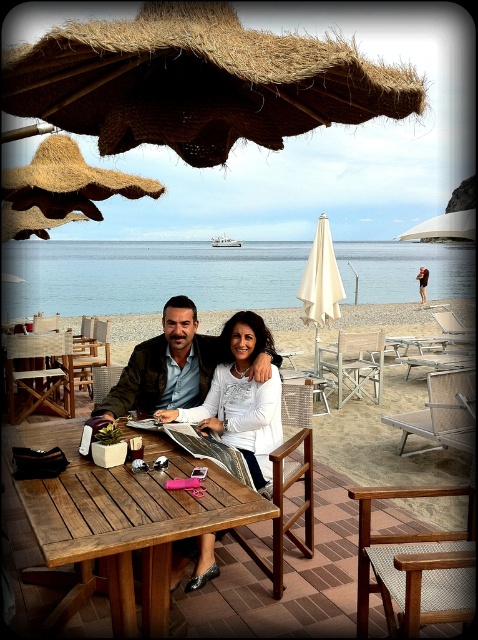
Question: Is thatched straw umbrella at upper center thinner than white matte dress at center?

Choices:
 (A) yes
 (B) no

Answer: (B)

Question: From the image, what is the correct spatial relationship of white matte dress at center in relation to wooden picnic table at center?

Choices:
 (A) below
 (B) above

Answer: (B)

Question: Which point appears farthest from the camera in this image?

Choices:
 (A) (136, 145)
 (B) (251, 381)
 (C) (315, 316)

Answer: (C)

Question: Considering the relative positions of blue water at center and beige fabric umbrella at center in the image provided, where is blue water at center located with respect to beige fabric umbrella at center?

Choices:
 (A) above
 (B) below

Answer: (A)

Question: Which of the following is the farthest from the observer?

Choices:
 (A) click(x=251, y=385)
 (B) click(x=173, y=298)

Answer: (A)

Question: Which point is farther from the camera taking this photo?

Choices:
 (A) (64, 344)
 (B) (264, 484)
 (C) (319, 266)
 (D) (417, 99)

Answer: (C)